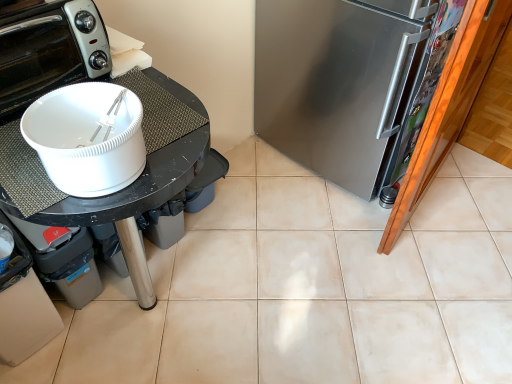
Question: Can you confirm if satin silver refrigerator at right is positioned to the right of white glossy toaster oven at upper left?

Choices:
 (A) yes
 (B) no

Answer: (A)

Question: Can you confirm if satin silver refrigerator at right is thinner than white glossy toaster oven at upper left?

Choices:
 (A) no
 (B) yes

Answer: (A)

Question: Does satin silver refrigerator at right have a smaller size compared to white glossy toaster oven at upper left?

Choices:
 (A) yes
 (B) no

Answer: (B)

Question: From a real-world perspective, is satin silver refrigerator at right positioned under white glossy toaster oven at upper left based on gravity?

Choices:
 (A) yes
 (B) no

Answer: (A)

Question: From a real-world perspective, is satin silver refrigerator at right located higher than white glossy toaster oven at upper left?

Choices:
 (A) yes
 (B) no

Answer: (B)

Question: Is satin silver refrigerator at right not close to white glossy toaster oven at upper left?

Choices:
 (A) no
 (B) yes

Answer: (A)

Question: Considering the relative sizes of white glossy toaster oven at upper left and satin silver refrigerator at right in the image provided, is white glossy toaster oven at upper left taller than satin silver refrigerator at right?

Choices:
 (A) yes
 (B) no

Answer: (B)

Question: Does white glossy toaster oven at upper left turn towards satin silver refrigerator at right?

Choices:
 (A) no
 (B) yes

Answer: (A)

Question: Does white glossy toaster oven at upper left have a greater width compared to satin silver refrigerator at right?

Choices:
 (A) yes
 (B) no

Answer: (B)

Question: Is the depth of white glossy toaster oven at upper left greater than that of satin silver refrigerator at right?

Choices:
 (A) yes
 (B) no

Answer: (B)

Question: Does white glossy toaster oven at upper left lie in front of satin silver refrigerator at right?

Choices:
 (A) no
 (B) yes

Answer: (B)

Question: From a real-world perspective, is white glossy toaster oven at upper left positioned over satin silver refrigerator at right based on gravity?

Choices:
 (A) yes
 (B) no

Answer: (A)

Question: Does satin silver refrigerator at right come behind black matte table at left?

Choices:
 (A) yes
 (B) no

Answer: (A)